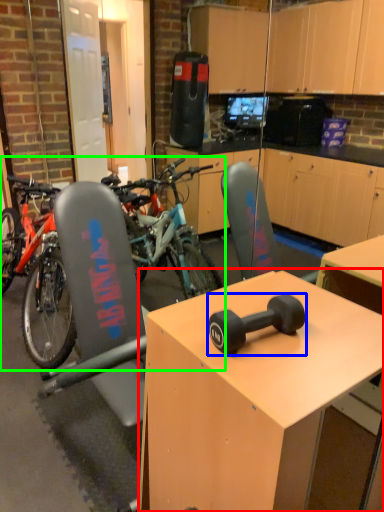
Question: Which object is the closest to the desk (highlighted by a red box)? Choose among these: dumbbell (highlighted by a blue box) or mountain bike (highlighted by a green box).

Choices:
 (A) dumbbell
 (B) mountain bike

Answer: (A)